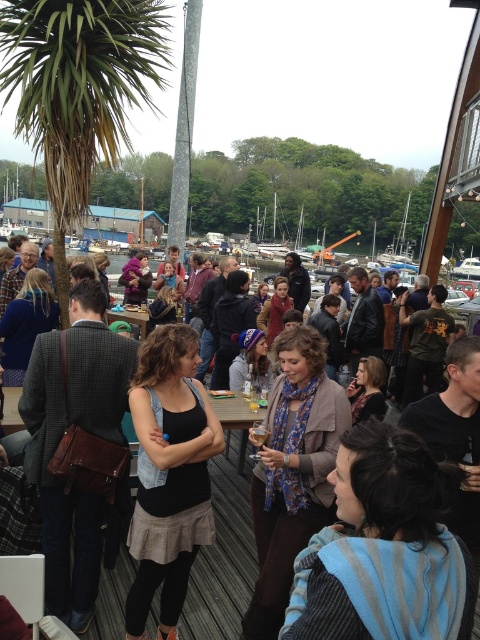
Does black denim tank top at center have a greater height compared to black leather jacket at center?

No.

From the picture: Which is below, black denim tank top at center or black leather jacket at center?

black denim tank top at center is below.

Looking at this image, who is more forward, (213, 536) or (215, 556)?

Point (213, 536) is in front.

Identify the location of black denim tank top at center. Image resolution: width=480 pixels, height=640 pixels. (168, 474).